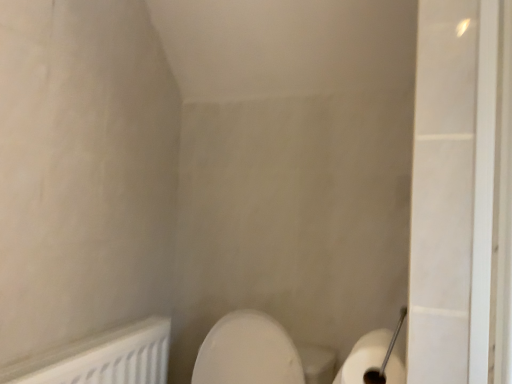
The image size is (512, 384). I want to click on white matte toilet paper at lower right, so click(364, 356).

This screenshot has width=512, height=384. What do you see at coordinates (364, 356) in the screenshot?
I see `white matte toilet paper at lower right` at bounding box center [364, 356].

The width and height of the screenshot is (512, 384). In order to click on white matte toilet paper at lower right in this screenshot , I will do `click(364, 356)`.